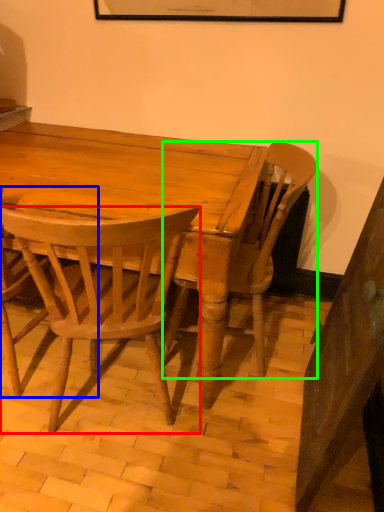
Question: Considering the real-world distances, which object is farthest from chair (highlighted by a red box)? chair (highlighted by a blue box) or chair (highlighted by a green box)?

Choices:
 (A) chair
 (B) chair

Answer: (B)